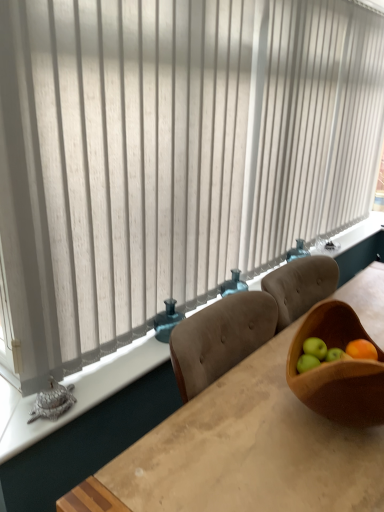
At what (x,y) coordinates should I click in order to perform the action: click on wooden table at center. Please return your answer as a coordinate pair (x, y). This screenshot has height=512, width=384. Looking at the image, I should click on (249, 451).

The image size is (384, 512). What do you see at coordinates (249, 451) in the screenshot?
I see `wooden table at center` at bounding box center [249, 451].

I want to click on wooden table at center, so click(x=249, y=451).